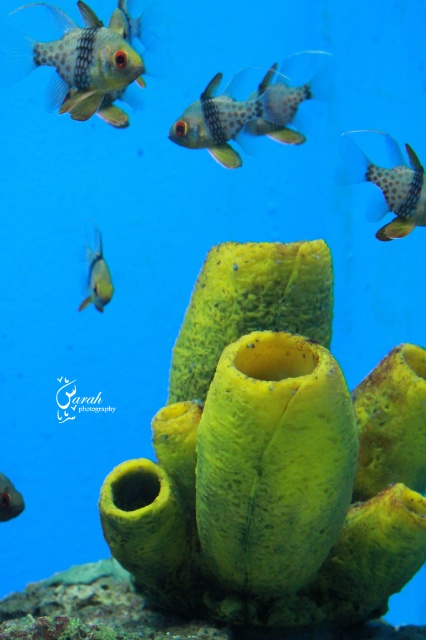
Question: Considering the real-world distances, which object is farthest from the shiny silver fish at lower left?

Choices:
 (A) translucent yellow fish at lower left
 (B) speckled plastic fish at center

Answer: (B)

Question: From the image, what is the correct spatial relationship of translucent yellow fish at lower left in relation to shiny silver fish at lower left?

Choices:
 (A) above
 (B) below

Answer: (A)

Question: Estimate the real-world distances between objects in this image. Which object is closer to the shiny silver fish at lower left?

Choices:
 (A) polka dot fabric fish at upper left
 (B) speckled plastic fish at center
 (C) translucent yellow fish at lower left
 (D) spotted orange fish at upper right

Answer: (C)

Question: In this image, where is spotted orange fish at upper right located relative to translucent yellow fish at lower left?

Choices:
 (A) left
 (B) right

Answer: (B)

Question: Among these points, which one is nearest to the camera?

Choices:
 (A) (394, 184)
 (B) (8, 515)
 (C) (51, 102)
 (D) (324, 81)

Answer: (C)

Question: Does polka dot fabric fish at upper left have a larger size compared to shiny silver fish at lower left?

Choices:
 (A) yes
 (B) no

Answer: (A)